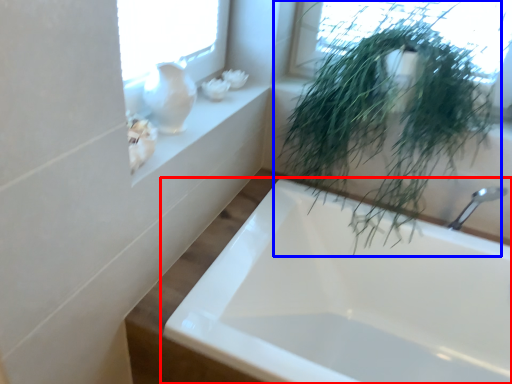
Question: Among these objects, which one is farthest to the camera, bathtub (highlighted by a red box) or houseplant (highlighted by a blue box)?

Choices:
 (A) bathtub
 (B) houseplant

Answer: (B)